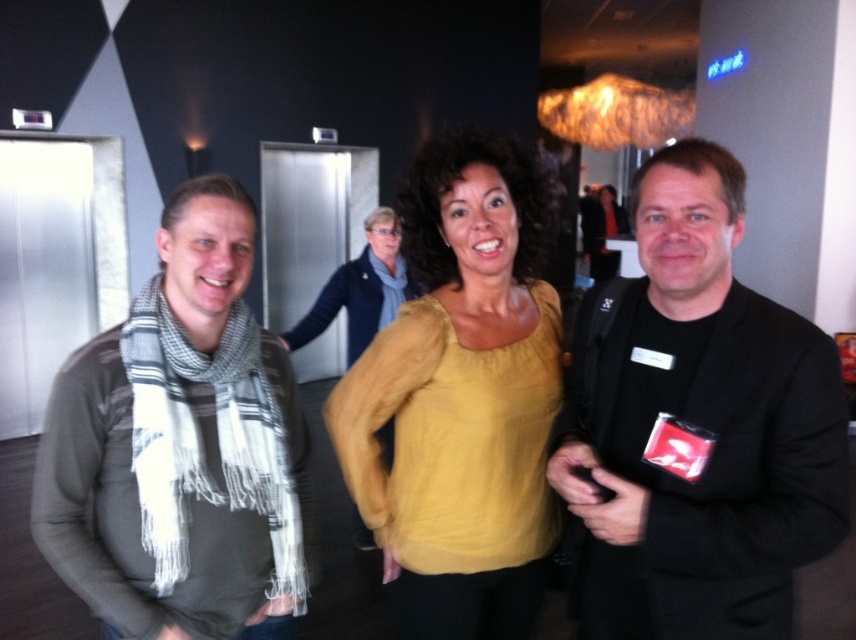
You are taking a photo of the three people in the scene. You want to focus on the person at point (623, 504) and the person at point (290, 401). Which person will be in sharper focus if you focus on the closer one?

Point (623, 504) is closer to the camera than point (290, 401), so the person at point (623, 504) will be in sharper focus if you focus on the closer one.

You are standing in the lobby and need to find the person wearing the black matte jacket at right. According to the image, where would you look to find them?

The black matte jacket at right is located at the position corresponding to the coordinate point (x=697, y=426) in the image.

You are standing in a lobby and see the black matte jacket at right. If you want to reach it without moving your feet, can you do it?

The black matte jacket at right is 1.01 meters from viewer, so if you can reach 1.01 meters or more, you can reach it without moving your feet.